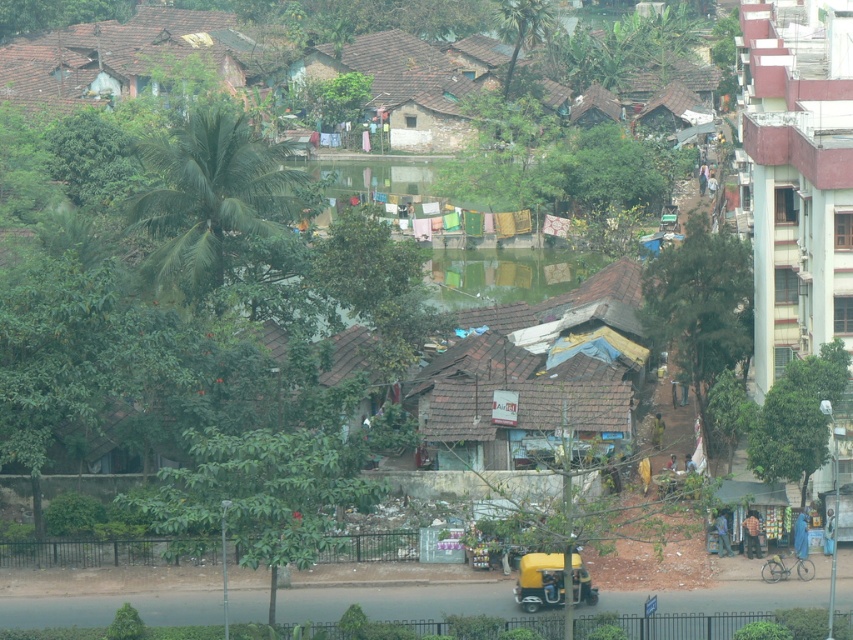
You are a city planner analyzing this area. You need to determine which tree, the green leafy tree at center or the green leafy tree at right, would be better to prune for easier maintenance. Based on their sizes, which one should you prioritize?

The green leafy tree at center is larger in size than the green leafy tree at right, so it should be prioritized for pruning since larger trees typically require more frequent maintenance.

You are standing in the middle of the road in the urban scene. There are two points marked on the image, point 1 at coordinates point (747, 307) and point 2 at coordinates point (671, 528). Which point is closer to you?

Point (747, 307) is further to the camera than point (671, 528), so the point closer to you is point (671, 528).

You are standing at the center of the road in the image. You see a point labeled as point (257, 496). What object does this point correspond to?

The point (257, 496) corresponds to the green leafy tree at lower left.